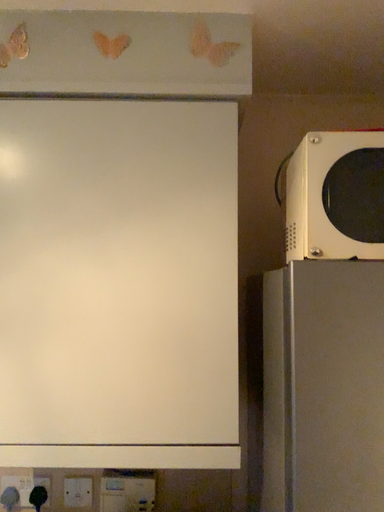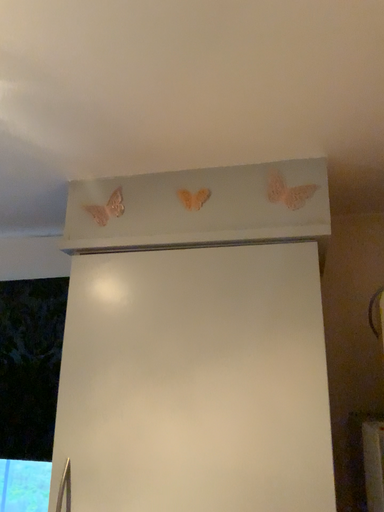
Question: Which way did the camera rotate in the video?

Choices:
 (A) rotated left
 (B) rotated right

Answer: (A)